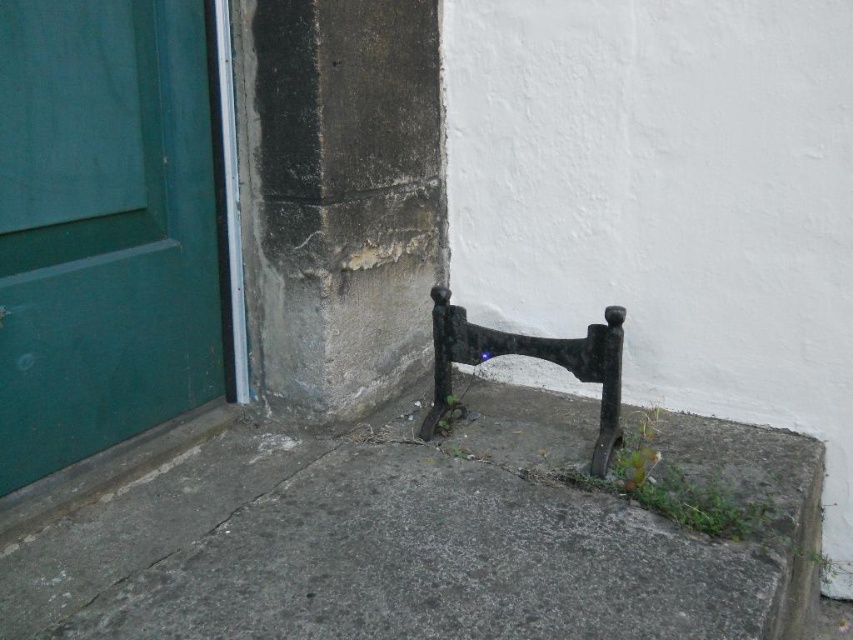
Question: Which point appears farthest from the camera in this image?

Choices:
 (A) (712, 540)
 (B) (78, 289)
 (C) (612, 397)

Answer: (C)

Question: Does gray concrete pavement at lower center appear under green matte door at left?

Choices:
 (A) yes
 (B) no

Answer: (A)

Question: Is green matte door at left below black wrought iron at lower right?

Choices:
 (A) no
 (B) yes

Answer: (A)

Question: Which of the following is the farthest from the observer?

Choices:
 (A) gray concrete pavement at lower center
 (B) green matte door at left

Answer: (B)

Question: Estimate the real-world distances between objects in this image. Which object is farther from the green matte door at left?

Choices:
 (A) black wrought iron at lower right
 (B) gray concrete pavement at lower center

Answer: (A)

Question: Does green matte door at left have a lesser width compared to black wrought iron at lower right?

Choices:
 (A) yes
 (B) no

Answer: (A)